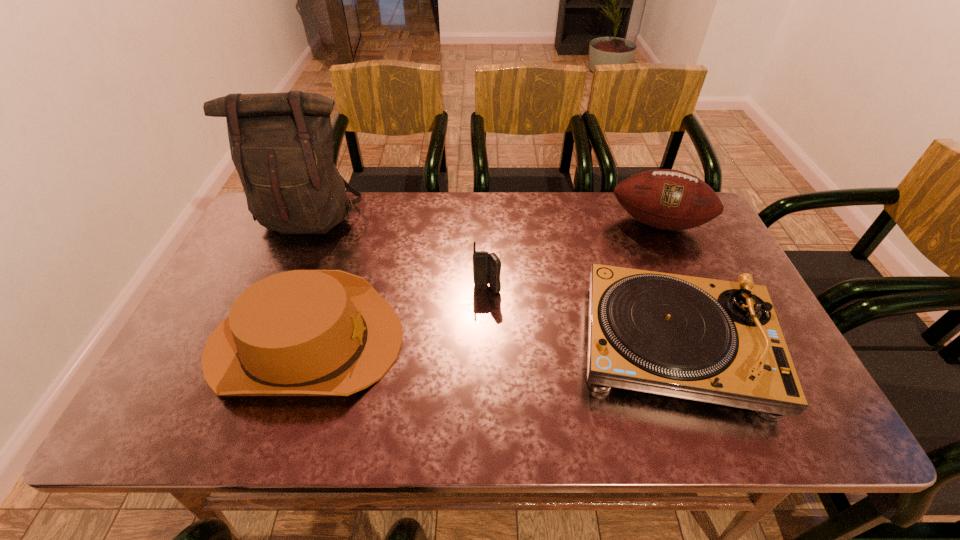
Where is `object that is at the far right corner`? The width and height of the screenshot is (960, 540). object that is at the far right corner is located at coordinates (668, 199).

Image resolution: width=960 pixels, height=540 pixels. I want to click on object located in the near right corner section of the desktop, so click(x=714, y=341).

I want to click on free space at the far edge of the desktop, so click(x=372, y=198).

In the image, there is a desktop. At what (x,y) coordinates should I click in order to perform the action: click on free space at the near edge. Please return your answer as a coordinate pair (x, y). The image size is (960, 540). Looking at the image, I should click on pos(403,424).

Locate an element on the screen. Image resolution: width=960 pixels, height=540 pixels. vacant position at the far left corner of the desktop is located at coordinates (250, 227).

You are a GUI agent. You are given a task and a screenshot of the screen. Output one action in this format:
    pyautogui.click(x=<x>, y=<y>)
    Task: Click on the free space at the far right corner
    
    Given the screenshot: What is the action you would take?
    pyautogui.click(x=700, y=228)

Find the location of `vacant space that's between the cellular telephone and the record player`. vacant space that's between the cellular telephone and the record player is located at coordinates (581, 318).

This screenshot has width=960, height=540. Identify the location of free space between the third object from right to left and the record player. (581, 318).

Identify the location of vacant space that's between the tallest object and the cellular telephone. point(398,254).

This screenshot has width=960, height=540. I want to click on vacant space that is in between the third object from left to right and the record player, so click(581, 318).